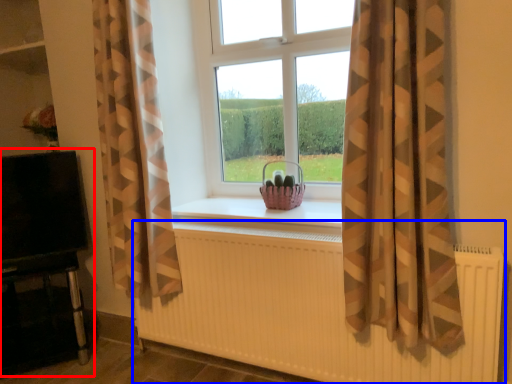
Question: Which object is further to the camera taking this photo, entertainment center (highlighted by a red box) or radiator (highlighted by a blue box)?

Choices:
 (A) entertainment center
 (B) radiator

Answer: (A)